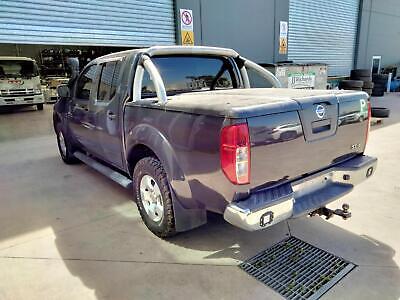
Find the location of a particular element. This screenshot has width=400, height=300. cover is located at coordinates (263, 98).